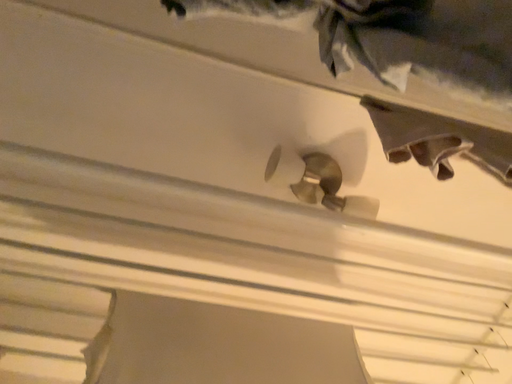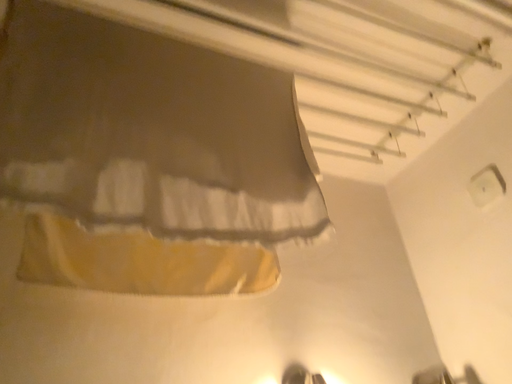
Question: How did the camera likely rotate when shooting the video?

Choices:
 (A) rotated downward
 (B) rotated upward

Answer: (A)